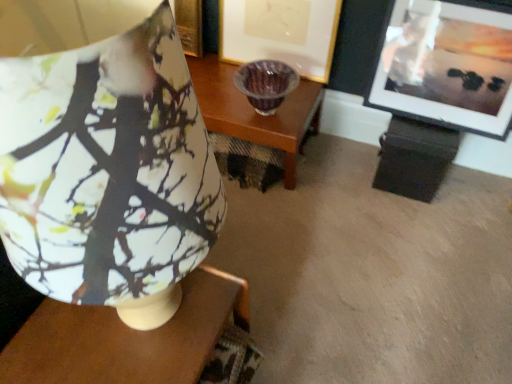
Locate an element on the screen. free point below matte ceramic lampshade at upper left (from a real-world perspective) is located at coordinates (147, 331).